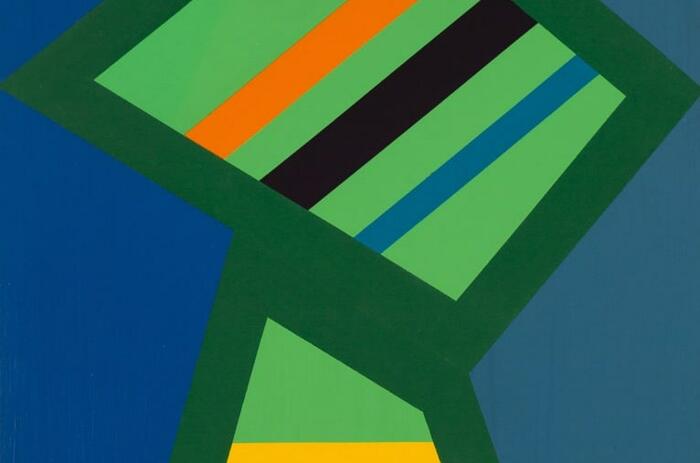
I want to click on art work, so click(206, 264).